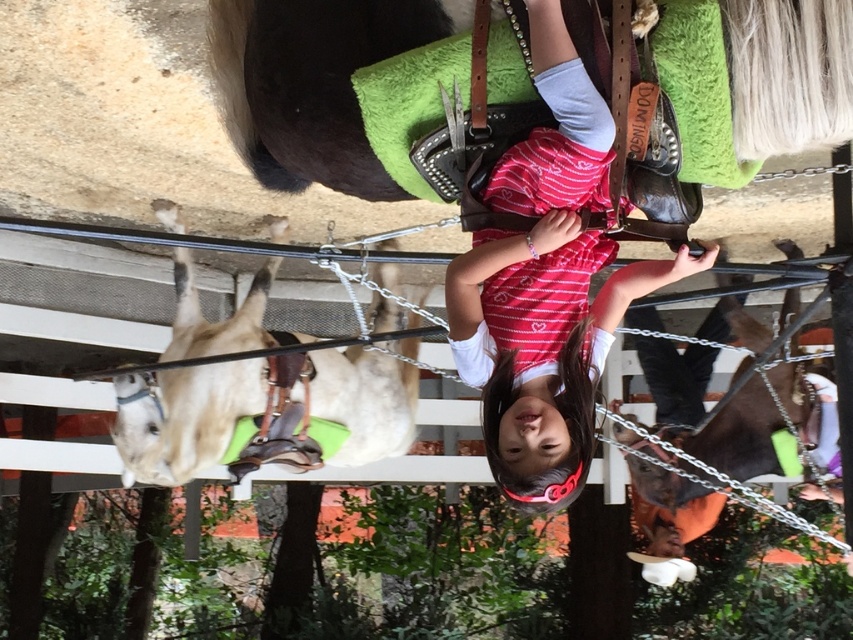
Is matte pink dress at center to the right of light brown leather horse at left from the viewer's perspective?

Yes, matte pink dress at center is to the right of light brown leather horse at left.

Find the location of a particular element. matte pink dress at center is located at coordinates (547, 284).